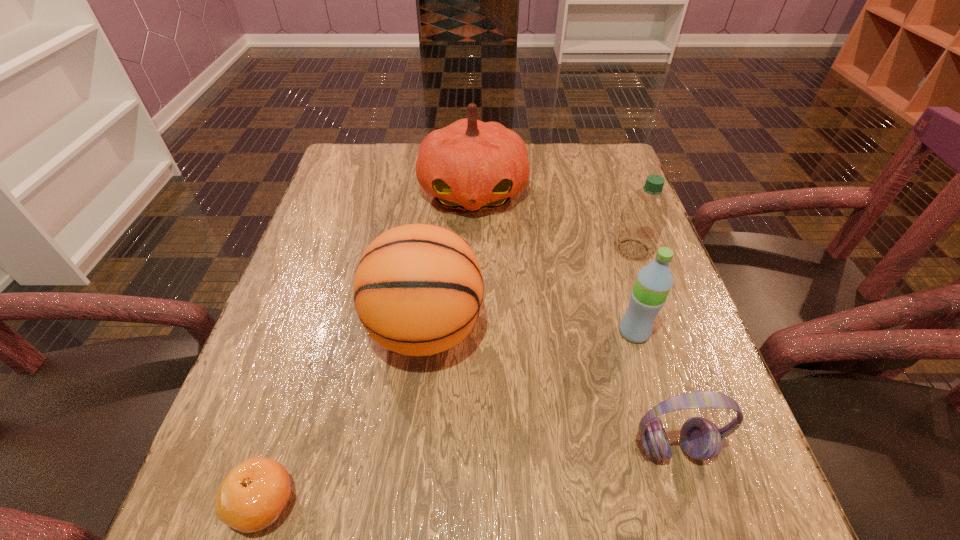
The height and width of the screenshot is (540, 960). I want to click on vacant area that satisfies the following two spatial constraints: 1. on the back side of the farther water bottle; 2. on the left side of the basketball, so click(x=434, y=249).

In order to click on vacant point that satisfies the following two spatial constraints: 1. on the front-facing side of the pumpkin; 2. on the right side of the farther water bottle in this screenshot , I will do `click(472, 249)`.

Find the location of a particular element. The width and height of the screenshot is (960, 540). vacant region that satisfies the following two spatial constraints: 1. on the front-facing side of the nearer water bottle; 2. on the left side of the pumpkin is located at coordinates pyautogui.click(x=470, y=332).